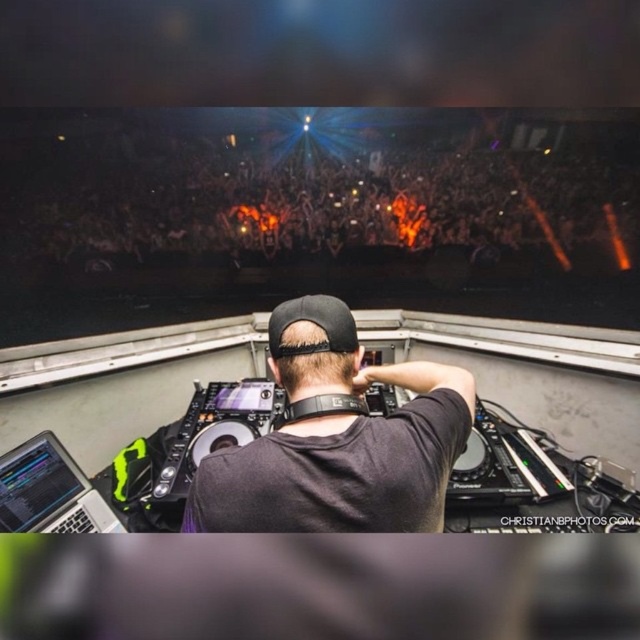
Question: Among these points, which one is nearest to the camera?

Choices:
 (A) (300, 301)
 (B) (20, 465)

Answer: (A)

Question: Which object appears farthest from the camera in this image?

Choices:
 (A) black matte shirt at center
 (B) silver/black laptop at lower left

Answer: (B)

Question: In this image, where is black matte shirt at center located relative to silver/black laptop at lower left?

Choices:
 (A) right
 (B) left

Answer: (A)

Question: Observing the image, what is the correct spatial positioning of black matte shirt at center in reference to silver/black laptop at lower left?

Choices:
 (A) below
 (B) above

Answer: (B)

Question: Can you confirm if black matte shirt at center is bigger than silver/black laptop at lower left?

Choices:
 (A) no
 (B) yes

Answer: (B)

Question: Which point appears farthest from the camera in this image?

Choices:
 (A) (269, 508)
 (B) (51, 477)

Answer: (B)